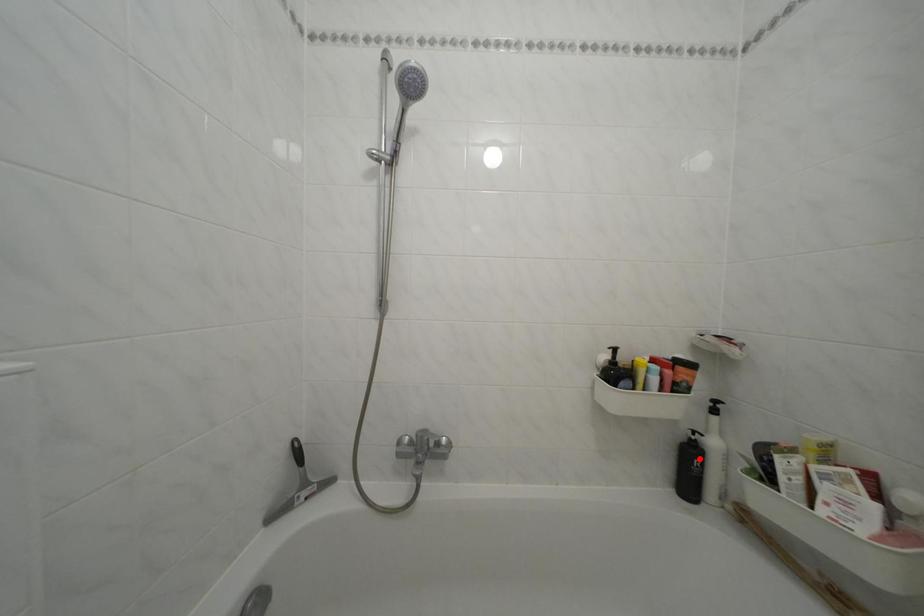
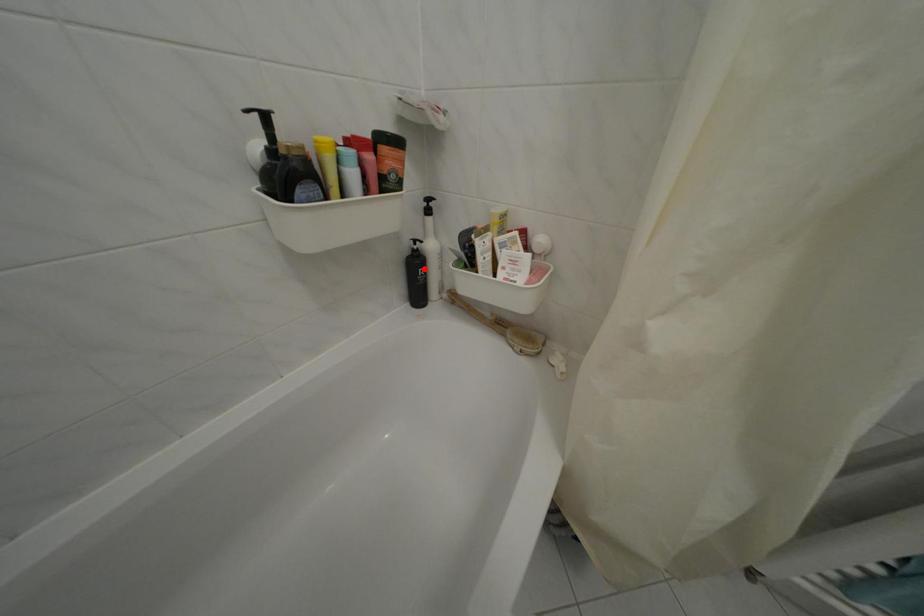
I am providing you with two images of the same scene from different viewpoints. A red point is marked on the first image and another point is marked on the second image. Is the marked point in image1 the same physical position as the marked point in image2?

Yes